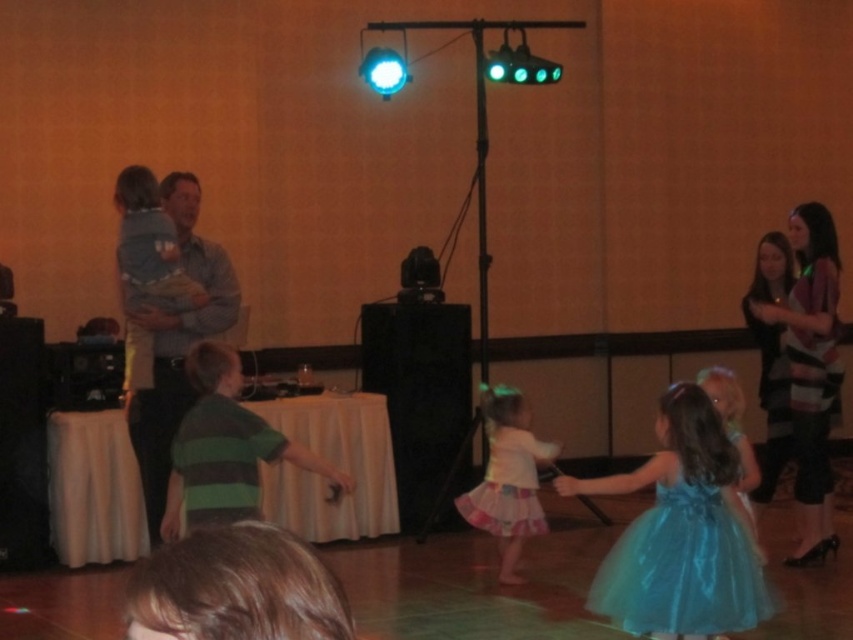
Which is below, striped sweater at right or white tulle skirt at center?

white tulle skirt at center is lower down.

Does point (799, 548) come closer to viewer compared to point (514, 444)?

No, it is behind (514, 444).

Does point (793, 234) come in front of point (526, 422)?

Yes.

Find the location of a particular element. The height and width of the screenshot is (640, 853). striped sweater at right is located at coordinates (810, 371).

Between shiny blue tulle dress at lower right and light blue fabric dress at center, which one has less height?

Standing shorter between the two is shiny blue tulle dress at lower right.

Who is lower down, shiny blue tulle dress at lower right or light blue fabric dress at center?

shiny blue tulle dress at lower right is below.

Locate an element on the screen. shiny blue tulle dress at lower right is located at coordinates (683, 566).

Between white tulle skirt at center and light blue fabric dress at center, which one has less height?

Standing shorter between the two is white tulle skirt at center.

Does white tulle skirt at center have a lesser width compared to light blue fabric dress at center?

No, white tulle skirt at center is not thinner than light blue fabric dress at center.

I want to click on white tulle skirt at center, so click(x=508, y=477).